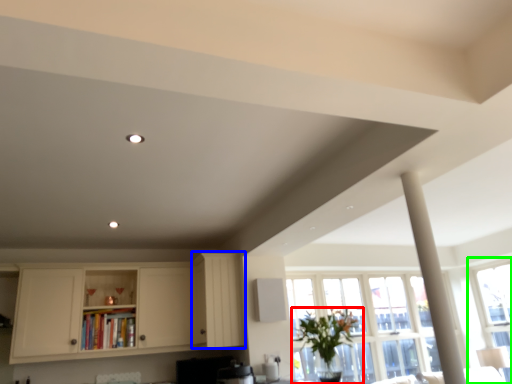
Question: Considering the real-world distances, which object is closest to houseplant (highlighted by a red box)? cabinetry (highlighted by a blue box) or window (highlighted by a green box).

Choices:
 (A) cabinetry
 (B) window

Answer: (A)